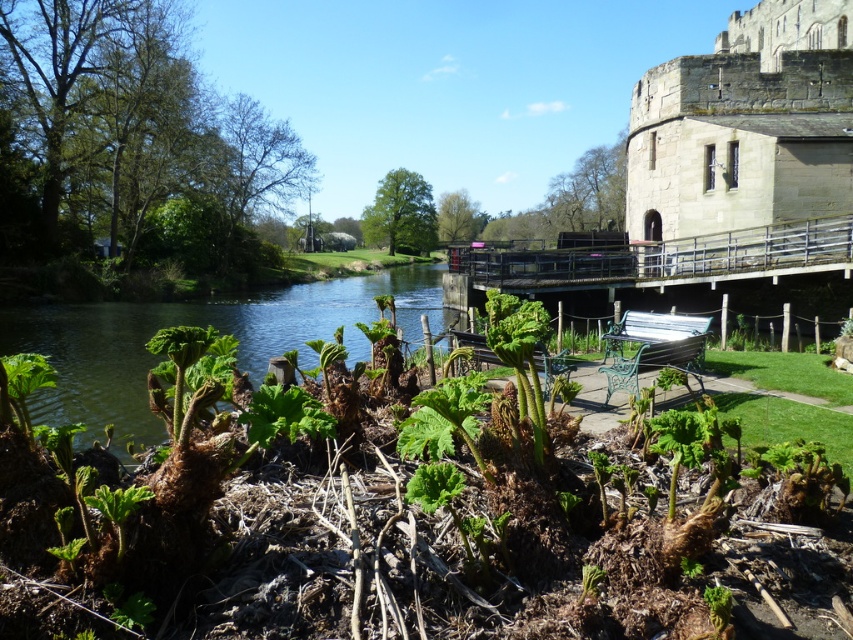
You are standing at the edge of the river and see the gray stone castle at upper right and the green leafy plants at center. Which object is higher in the image?

The gray stone castle at upper right is higher in the image than the green leafy plants at center because it is positioned above it.